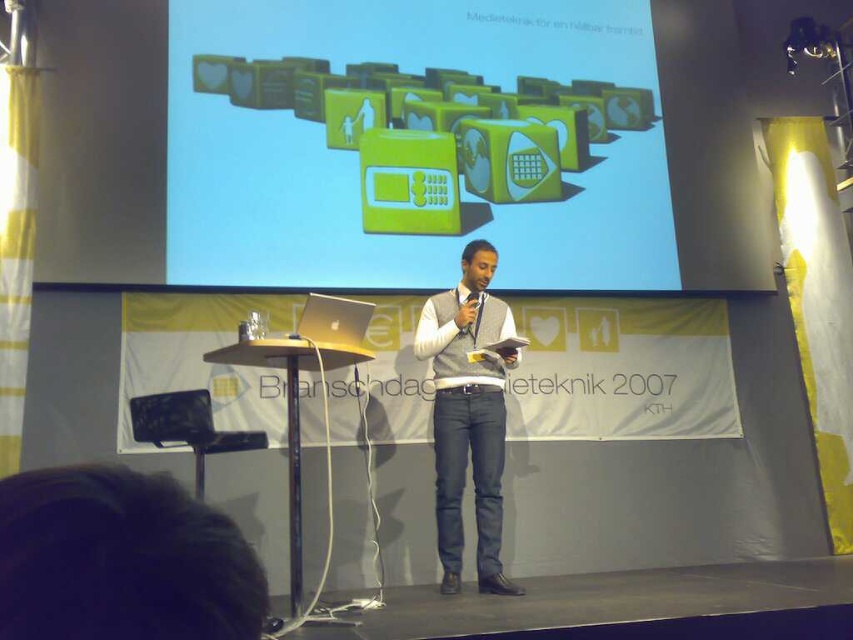
Can you confirm if green glossy microwave at upper center is positioned to the left of black plastic microphone at center?

Yes, green glossy microwave at upper center is to the left of black plastic microphone at center.

Is green glossy microwave at upper center in front of black plastic microphone at center?

That is False.

Is point (297, 276) farther from camera compared to point (471, 294)?

Yes, point (297, 276) is behind point (471, 294).

In order to click on green glossy microwave at upper center in this screenshot , I will do `click(415, 144)`.

Is green glossy microwave at upper center thinner than gray sweater vest at center?

In fact, green glossy microwave at upper center might be wider than gray sweater vest at center.

Consider the image. Which of these two, green glossy microwave at upper center or gray sweater vest at center, stands shorter?

gray sweater vest at center

Between point (202, 273) and point (469, 307), which one is positioned behind?

Positioned behind is point (202, 273).

Image resolution: width=853 pixels, height=640 pixels. Identify the location of green glossy microwave at upper center. (415, 144).

Does gray sweater vest at center appear under black plastic microphone at center?

Correct, gray sweater vest at center is located below black plastic microphone at center.

Locate an element on the screen. gray sweater vest at center is located at coordinates (467, 417).